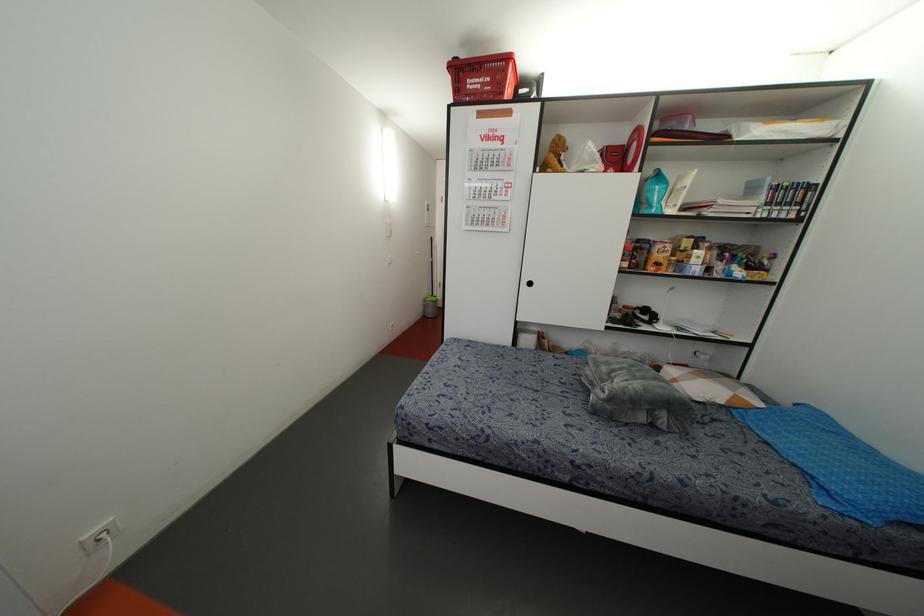
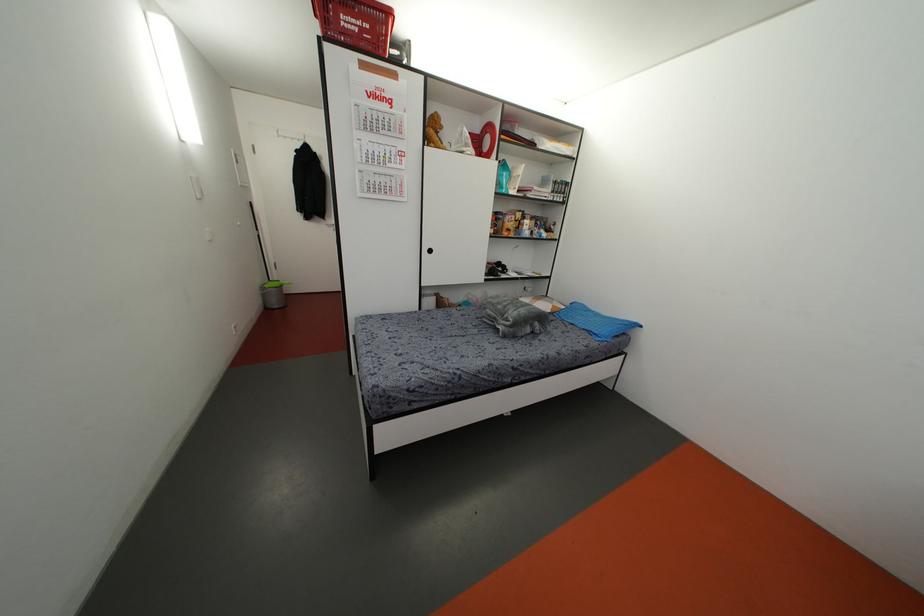
Find the pixel in the second image that matches point (507, 58) in the first image.

(388, 13)